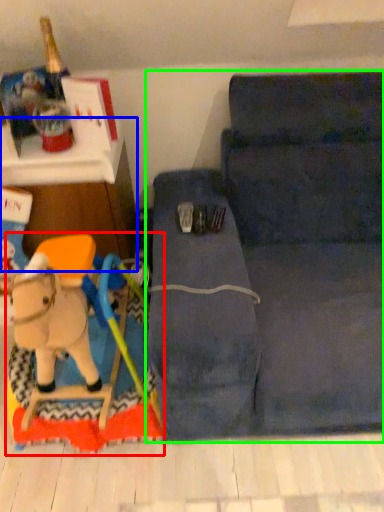
Question: Based on their relative distances, which object is nearer to toy (highlighted by a red box)? Choose from furniture (highlighted by a blue box) and studio couch (highlighted by a green box).

Choices:
 (A) furniture
 (B) studio couch

Answer: (A)